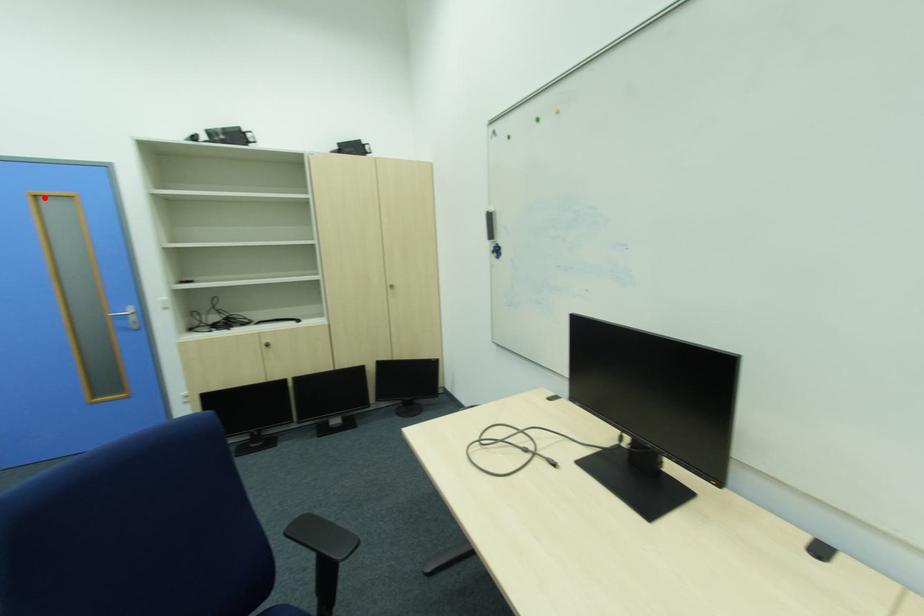
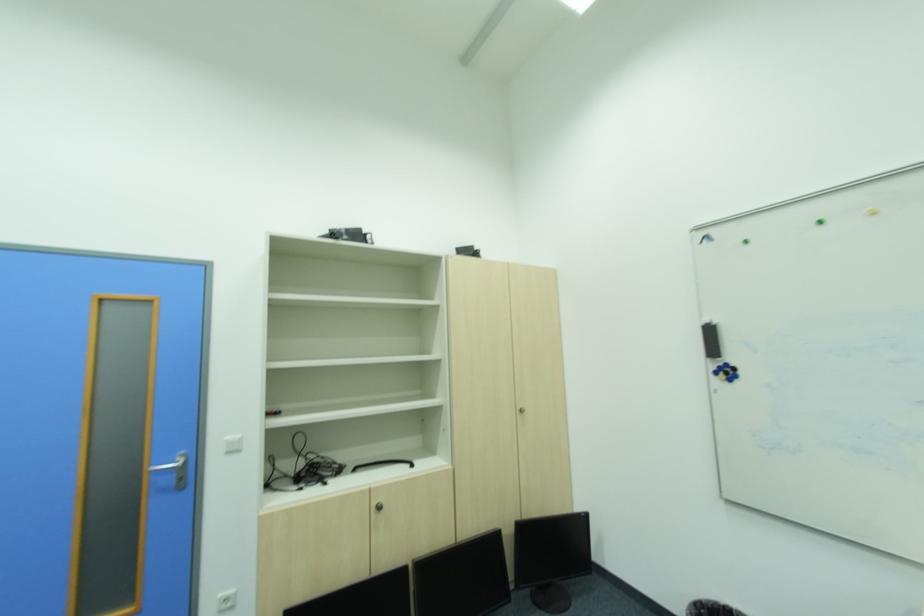
Question: I am providing you with two images of the same scene from different viewpoints. A red point is shown in image1. For the corresponding object point in image2, is it positioned nearer or farther from the camera?

Choices:
 (A) Nearer
 (B) Farther

Answer: (A)